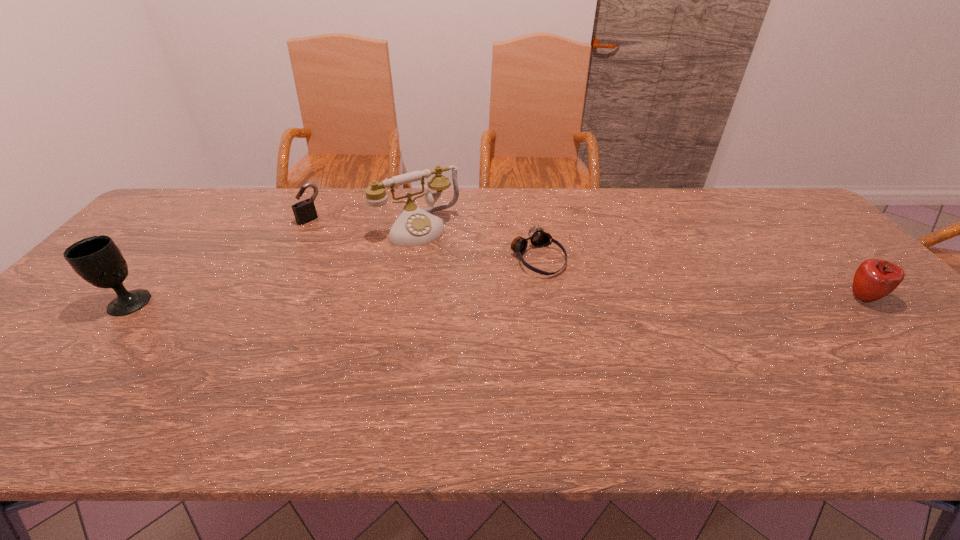
Identify the location of unoccupied position between the chalice and the padlock. [219, 261].

At what (x,y) coordinates should I click in order to perform the action: click on empty space between the chalice and the second object from left to right. Please return your answer as a coordinate pair (x, y). Looking at the image, I should click on (219, 261).

Find the location of `blank region between the padlock and the leftmost object`. blank region between the padlock and the leftmost object is located at coordinates (219, 261).

Image resolution: width=960 pixels, height=540 pixels. In order to click on unoccupied area between the rightmost object and the goggles in this screenshot , I will do `click(700, 278)`.

Find the location of a particular element. object that is the second closest one to the telephone is located at coordinates (304, 211).

Locate which object is the second closest to the apple. Please provide its 2D coordinates. Your answer should be formatted as a tuple, i.e. [(x, y)], where the tuple contains the x and y coordinates of a point satisfying the conditions above.

[(414, 226)]

Locate an element on the screen. free region that satisfies the following two spatial constraints: 1. on the front side of the shortest object; 2. on the right side of the rightmost object is located at coordinates (544, 298).

This screenshot has width=960, height=540. Find the location of `vacant position in the image that satisfies the following two spatial constraints: 1. on the front side of the second object from left to right; 2. on the left side of the telephone`. vacant position in the image that satisfies the following two spatial constraints: 1. on the front side of the second object from left to right; 2. on the left side of the telephone is located at coordinates (305, 228).